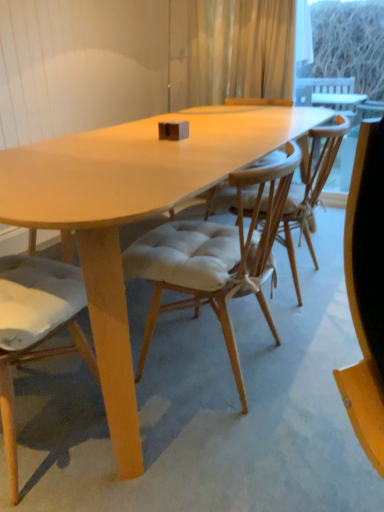
Image resolution: width=384 pixels, height=512 pixels. What do you see at coordinates (215, 258) in the screenshot?
I see `light beige fabric chair at center, which is the second chair in left-to-right order` at bounding box center [215, 258].

Find the location of a particular element. light brown wood chair at center, the 2th chair viewed from the right is located at coordinates (35, 329).

Measure the distance between point (245, 72) and camera.

9.96 feet.

You are a GUI agent. You are given a task and a screenshot of the screen. Output one action in this format:
    pyautogui.click(x=<x>, y=<y>)
    Task: Click on the translucent fabric curtain at upper center
    This screenshot has height=512, width=384.
    Given the screenshot: What is the action you would take?
    pyautogui.click(x=239, y=50)

What do you see at coordinates (346, 67) in the screenshot? This screenshot has width=384, height=512. I see `transparent glass window screen at upper right` at bounding box center [346, 67].

Identify the location of light beige fabric chair at center, the 1th chair when ordered from right to left. The image size is (384, 512). (215, 258).

In terms of size, does translucent fabric curtain at upper center appear bigger or smaller than light brown wood chair at center, the 2th chair viewed from the right?

In the image, translucent fabric curtain at upper center appears to be smaller than light brown wood chair at center, the 2th chair viewed from the right.

Between translucent fabric curtain at upper center and light brown wood chair at center, the 1th chair viewed from the left, which one appears on the right side from the viewer's perspective?

translucent fabric curtain at upper center is more to the right.

Which object is further away from the camera, translucent fabric curtain at upper center or light brown wood chair at center, the 1th chair viewed from the left?

translucent fabric curtain at upper center is further away from the camera.

Is translucent fabric curtain at upper center beside light brown wood chair at center, the 1th chair viewed from the left?

No, translucent fabric curtain at upper center is not making contact with light brown wood chair at center, the 1th chair viewed from the left.

Relative to transparent glass window screen at upper right, is light beige fabric chair at center, the 1th chair when ordered from right to left, in front or behind?

Visually, light beige fabric chair at center, the 1th chair when ordered from right to left, is located in front of transparent glass window screen at upper right.

Is light beige fabric chair at center, the 1th chair when ordered from right to left, aimed at transparent glass window screen at upper right?

No, light beige fabric chair at center, the 1th chair when ordered from right to left, does not turn towards transparent glass window screen at upper right.

From the picture: Considering the relative positions of light beige fabric chair at center, the 1th chair when ordered from right to left, and transparent glass window screen at upper right in the image provided, is light beige fabric chair at center, the 1th chair when ordered from right to left, to the left of transparent glass window screen at upper right from the viewer's perspective?

Indeed, light beige fabric chair at center, the 1th chair when ordered from right to left, is positioned on the left side of transparent glass window screen at upper right.

How far apart are transparent glass window screen at upper right and light brown wood chair at center, the 1th chair viewed from the left?

Answer: 5.04 meters.

Looking at this image, in terms of width, does transparent glass window screen at upper right look wider or thinner when compared to light brown wood chair at center, the 2th chair viewed from the right?

Considering their sizes, transparent glass window screen at upper right looks slimmer than light brown wood chair at center, the 2th chair viewed from the right.

What's the angular difference between transparent glass window screen at upper right and light brown wood chair at center, the 1th chair viewed from the left,'s facing directions?

The angle between the facing direction of transparent glass window screen at upper right and the facing direction of light brown wood chair at center, the 1th chair viewed from the left, is 179 degrees.

From the image's perspective, which is below, transparent glass window screen at upper right or light brown wood chair at center, the 2th chair viewed from the right?

light brown wood chair at center, the 2th chair viewed from the right, is shown below in the image.

Is light brown wood chair at center, the 2th chair viewed from the right, wider than translucent fabric curtain at upper center?

Correct, the width of light brown wood chair at center, the 2th chair viewed from the right, exceeds that of translucent fabric curtain at upper center.

Looking at this image, is light brown wood chair at center, the 2th chair viewed from the right, oriented away from translucent fabric curtain at upper center?

No, light brown wood chair at center, the 2th chair viewed from the right,'s orientation is not away from translucent fabric curtain at upper center.

Is light brown wood chair at center, the 2th chair viewed from the right, completely or partially outside of translucent fabric curtain at upper center?

That's correct, light brown wood chair at center, the 2th chair viewed from the right, is outside of translucent fabric curtain at upper center.

How much distance is there between light brown wood chair at center, the 1th chair viewed from the left, and translucent fabric curtain at upper center?

A distance of 7.67 feet exists between light brown wood chair at center, the 1th chair viewed from the left, and translucent fabric curtain at upper center.

Does light brown wood chair at center, the 2th chair viewed from the right, have a lesser height compared to light beige fabric chair at center, the 1th chair when ordered from right to left?

In fact, light brown wood chair at center, the 2th chair viewed from the right, may be taller than light beige fabric chair at center, the 1th chair when ordered from right to left.

Is light brown wood chair at center, the 2th chair viewed from the right, situated inside light beige fabric chair at center, the 1th chair when ordered from right to left, or outside?

light brown wood chair at center, the 2th chair viewed from the right, is located beyond the bounds of light beige fabric chair at center, the 1th chair when ordered from right to left.

Could you measure the distance between light brown wood chair at center, the 1th chair viewed from the left, and light beige fabric chair at center, which is the second chair in left-to-right order?

The distance of light brown wood chair at center, the 1th chair viewed from the left, from light beige fabric chair at center, which is the second chair in left-to-right order, is 41.89 centimeters.

Which of these two, light brown wood chair at center, the 1th chair viewed from the left, or light beige fabric chair at center, which is the second chair in left-to-right order, is bigger?

light brown wood chair at center, the 1th chair viewed from the left, is bigger.

Is light beige fabric chair at center, which is the second chair in left-to-right order, inside the boundaries of light brown wood chair at center, the 1th chair viewed from the left, or outside?

light beige fabric chair at center, which is the second chair in left-to-right order, is not inside light brown wood chair at center, the 1th chair viewed from the left, it's outside.

From a real-world perspective, is light beige fabric chair at center, the 1th chair when ordered from right to left, below light brown wood chair at center, the 2th chair viewed from the right?

Yes.

Which point is more distant from viewer, (181, 276) or (39, 304)?

The point (181, 276) is more distant.

From the image's perspective, between transparent glass window screen at upper right and light beige fabric chair at center, the 1th chair when ordered from right to left, who is located below?

light beige fabric chair at center, the 1th chair when ordered from right to left, appears lower in the image.

Consider the image. Is transparent glass window screen at upper right placed right next to light beige fabric chair at center, the 1th chair when ordered from right to left?

transparent glass window screen at upper right is not next to light beige fabric chair at center, the 1th chair when ordered from right to left, and they're not touching.

Is light beige fabric chair at center, the 1th chair when ordered from right to left, at the back of transparent glass window screen at upper right?

transparent glass window screen at upper right does not have its back to light beige fabric chair at center, the 1th chair when ordered from right to left.

Can you confirm if transparent glass window screen at upper right is smaller than light beige fabric chair at center, the 1th chair when ordered from right to left?

Correct, transparent glass window screen at upper right occupies less space than light beige fabric chair at center, the 1th chair when ordered from right to left.

Find the location of a particular element. The width and height of the screenshot is (384, 512). curtain that is above the light brown wood chair at center, the 1th chair viewed from the left (from a real-world perspective) is located at coordinates (239, 50).

At what (x,y) coordinates should I click in order to perform the action: click on chair that is the 2nd one below the transparent glass window screen at upper right (from a real-world perspective). Please return your answer as a coordinate pair (x, y). The height and width of the screenshot is (512, 384). Looking at the image, I should click on (215, 258).

From the image, which object appears to be farther from translucent fabric curtain at upper center, transparent glass window screen at upper right or light beige fabric chair at center, which is the second chair in left-to-right order?

transparent glass window screen at upper right is positioned further to the anchor translucent fabric curtain at upper center.

Based on the photo, from the image, which object appears to be farther from translucent fabric curtain at upper center, light brown wood chair at center, the 1th chair viewed from the left, or transparent glass window screen at upper right?

transparent glass window screen at upper right is positioned further to the anchor translucent fabric curtain at upper center.

Which object lies further to the anchor point light brown wood chair at center, the 2th chair viewed from the right, transparent glass window screen at upper right or light beige fabric chair at center, which is the second chair in left-to-right order?

Among the two, transparent glass window screen at upper right is located further to light brown wood chair at center, the 2th chair viewed from the right.

Estimate the real-world distances between objects in this image. Which object is further from translucent fabric curtain at upper center, light brown wood chair at center, the 2th chair viewed from the right, or light beige fabric chair at center, the 1th chair when ordered from right to left?

Among the two, light brown wood chair at center, the 2th chair viewed from the right, is located further to translucent fabric curtain at upper center.

Considering their positions, is light beige fabric chair at center, the 1th chair when ordered from right to left, positioned further to light brown wood chair at center, the 1th chair viewed from the left, than translucent fabric curtain at upper center?

The object further to light brown wood chair at center, the 1th chair viewed from the left, is translucent fabric curtain at upper center.

When comparing their distances from transparent glass window screen at upper right, does light beige fabric chair at center, which is the second chair in left-to-right order, or translucent fabric curtain at upper center seem further?

light beige fabric chair at center, which is the second chair in left-to-right order, is positioned further to the anchor transparent glass window screen at upper right.

Looking at the image, which one is located closer to light brown wood chair at center, the 1th chair viewed from the left, transparent glass window screen at upper right or translucent fabric curtain at upper center?

Based on the image, translucent fabric curtain at upper center appears to be nearer to light brown wood chair at center, the 1th chair viewed from the left.

Estimate the real-world distances between objects in this image. Which object is further from transparent glass window screen at upper right, translucent fabric curtain at upper center or light beige fabric chair at center, which is the second chair in left-to-right order?

Based on the image, light beige fabric chair at center, which is the second chair in left-to-right order, appears to be further to transparent glass window screen at upper right.

I want to click on curtain between light brown wood chair at center, the 2th chair viewed from the right, and transparent glass window screen at upper right in the front-back direction, so click(239, 50).

Locate an element on the screen. This screenshot has width=384, height=512. chair between light brown wood chair at center, the 2th chair viewed from the right, and transparent glass window screen at upper right, along the z-axis is located at coordinates (215, 258).

The width and height of the screenshot is (384, 512). I want to click on chair between translucent fabric curtain at upper center and light brown wood chair at center, the 1th chair viewed from the left, in the up-down direction, so click(x=215, y=258).

Where is `curtain between light beige fabric chair at center, the 1th chair when ordered from right to left, and transparent glass window screen at upper right from front to back`? curtain between light beige fabric chair at center, the 1th chair when ordered from right to left, and transparent glass window screen at upper right from front to back is located at coordinates (239, 50).